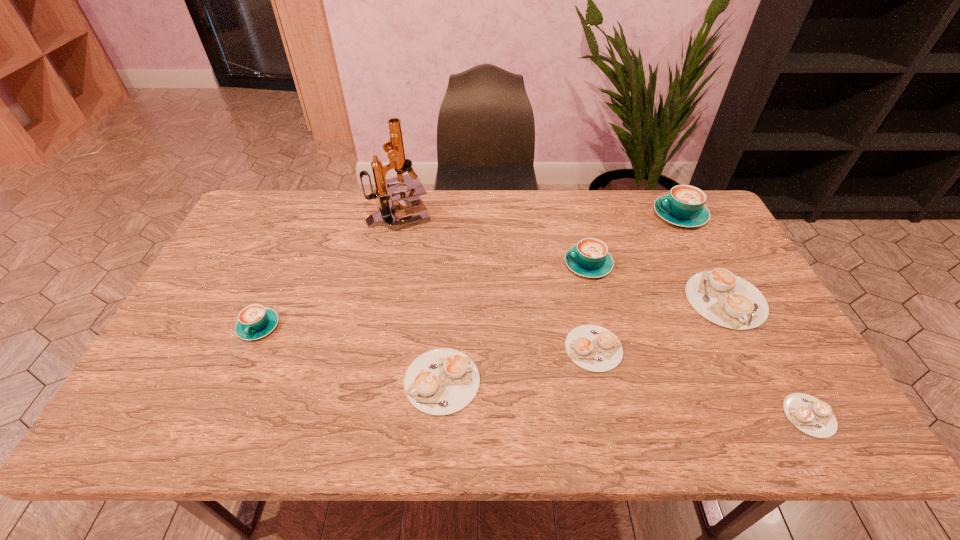
The width and height of the screenshot is (960, 540). What are the coordinates of `vacant area that satisfies the following two spatial constraints: 1. with the handle on the right side of the second tallest cappuccino; 2. on the front side of the sixth tallest object` in the screenshot? It's located at (616, 381).

Where is `blank space that satisfies the following two spatial constraints: 1. at the eyepiece of the microscope; 2. on the right side of the smallest white cappuccino`? The height and width of the screenshot is (540, 960). blank space that satisfies the following two spatial constraints: 1. at the eyepiece of the microscope; 2. on the right side of the smallest white cappuccino is located at coordinates (358, 415).